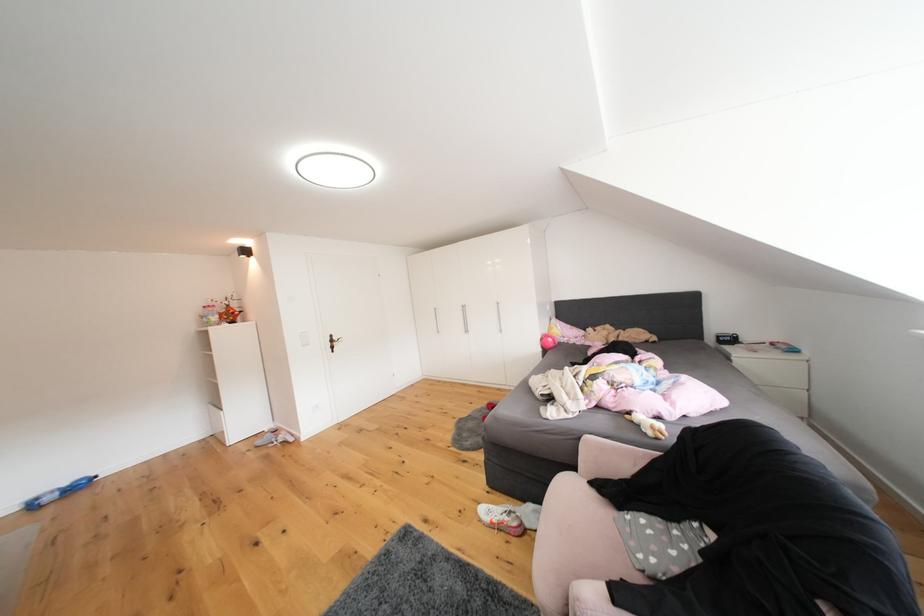
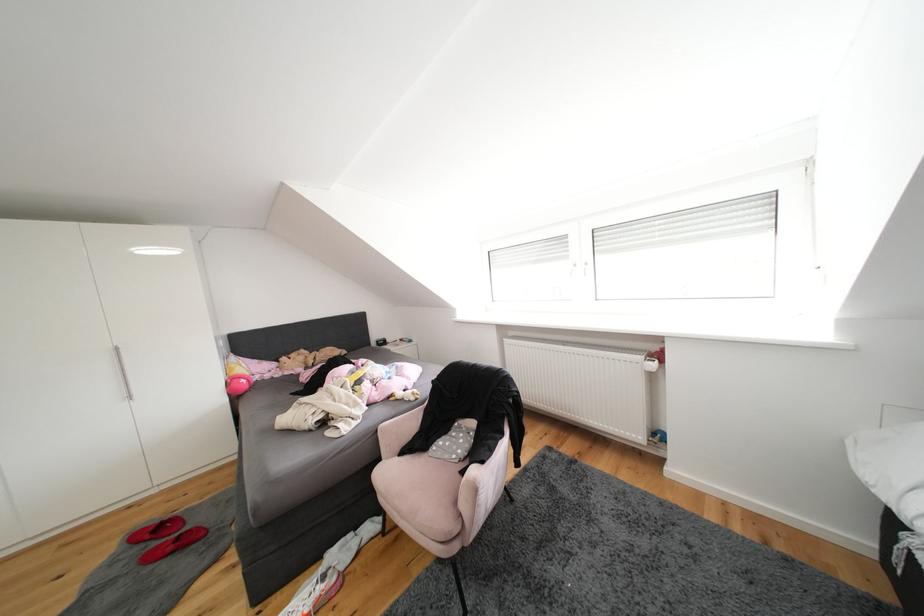
Where in the second image is the point corresponding to point 602,381 from the first image?

(368, 386)